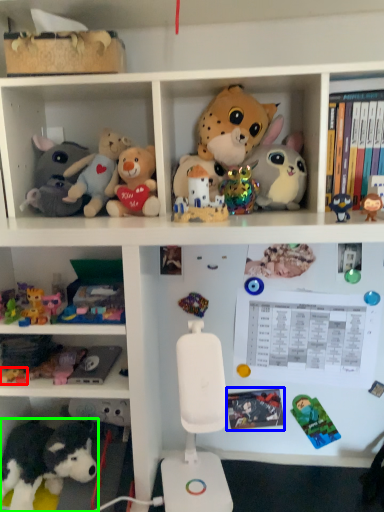
Question: Based on their relative distances, which object is farther from toy (highlighted by a red box)? Choose from book (highlighted by a blue box) and toy (highlighted by a green box).

Choices:
 (A) book
 (B) toy

Answer: (A)